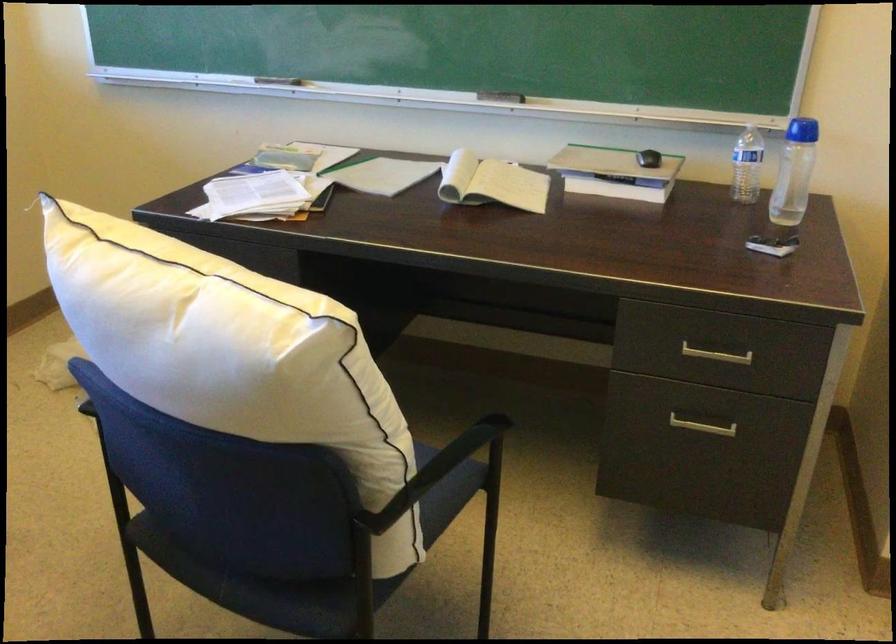
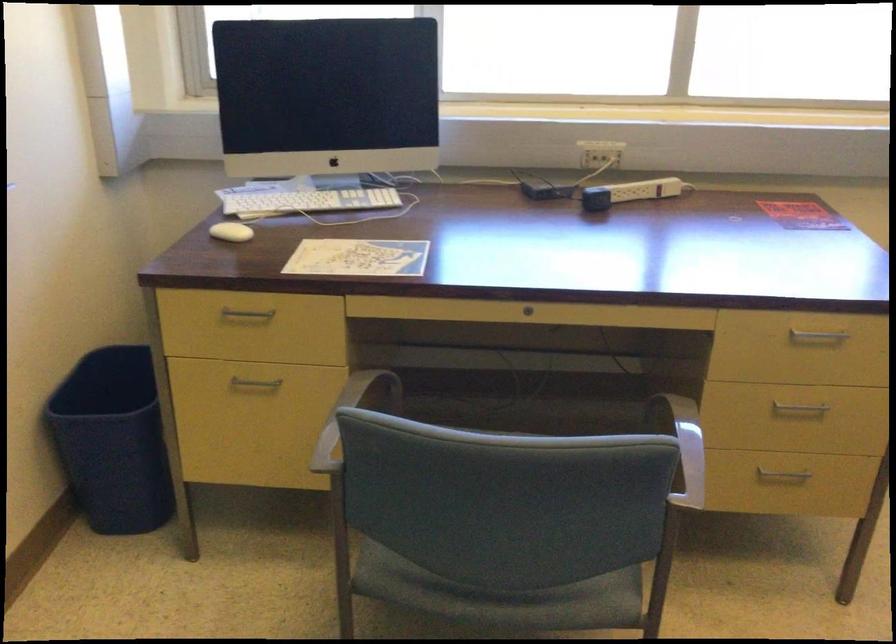
How did the camera likely rotate?

The camera rotated toward left-down.